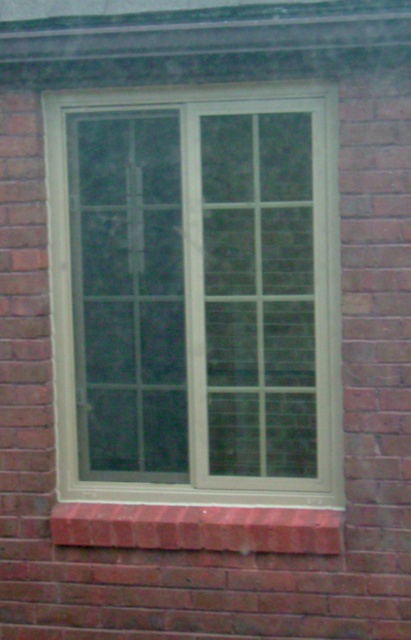
Question: From the image, what is the correct spatial relationship of white plastic window at center in relation to red brick window sill at lower center?

Choices:
 (A) below
 (B) above

Answer: (B)

Question: Is the position of white plastic window at center less distant than that of red brick window sill at lower center?

Choices:
 (A) yes
 (B) no

Answer: (A)

Question: Which object appears closest to the camera in this image?

Choices:
 (A) red brick window sill at lower center
 (B) white plastic window at center

Answer: (B)

Question: Does white plastic window at center have a larger size compared to red brick window sill at lower center?

Choices:
 (A) no
 (B) yes

Answer: (B)